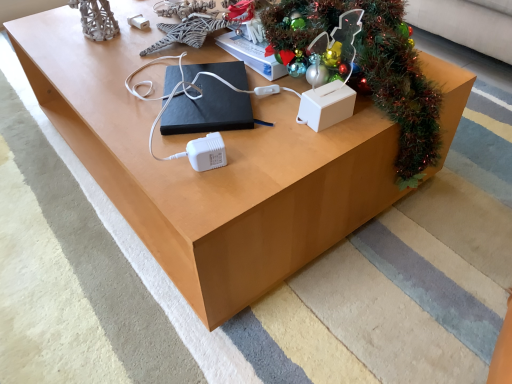
The image size is (512, 384). In order to click on vacant space that is to the left of white plastic tissue box at center-right in this screenshot , I will do 265,125.